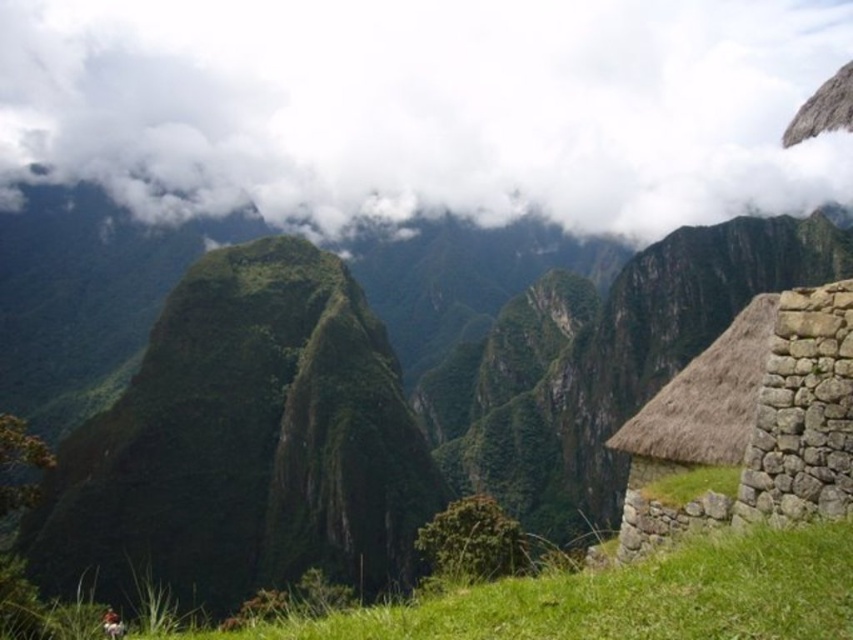
Question: Among these objects, which one is farthest from the camera?

Choices:
 (A) brown thatch hut at right
 (B) green grassy at lower center
 (C) white fluffy cloud at upper center

Answer: (C)

Question: Considering the relative positions of white fluffy cloud at upper center and green grassy at lower center in the image provided, where is white fluffy cloud at upper center located with respect to green grassy at lower center?

Choices:
 (A) above
 (B) below

Answer: (A)

Question: Does white fluffy cloud at upper center appear on the left side of green grassy at lower center?

Choices:
 (A) yes
 (B) no

Answer: (A)

Question: Is green grassy at lower center below brown thatch hut at right?

Choices:
 (A) no
 (B) yes

Answer: (A)

Question: Which of the following is the farthest from the observer?

Choices:
 (A) (772, 324)
 (B) (714, 596)
 (C) (347, 150)

Answer: (C)

Question: Estimate the real-world distances between objects in this image. Which object is closer to the white fluffy cloud at upper center?

Choices:
 (A) green grassy at lower center
 (B) brown thatch hut at right

Answer: (B)